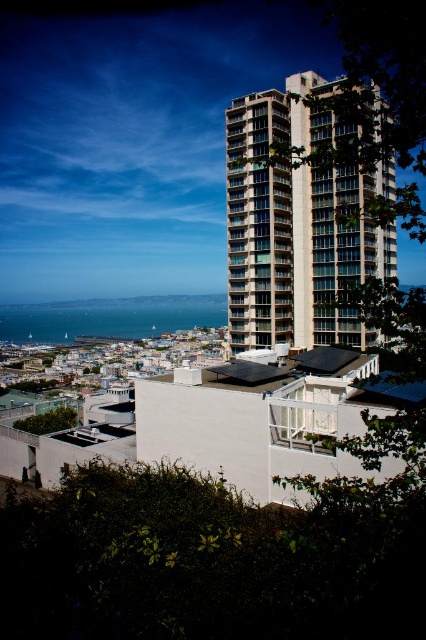
You are a city planner analyzing the coastal area. You need to determine if the beige concrete building at center can be seen from the blue water at lower left. Based on their relative widths, can you infer which one is narrower?

The beige concrete building at center is narrower than the blue water at lower left because its width is less than that of the blue water at lower left.

You are standing at the edge of the blue water at lower left and want to walk towards the beige concrete building at center. Which direction should you head?

You should head to the right to reach the beige concrete building at center since it is located to the right of the blue water at lower left.